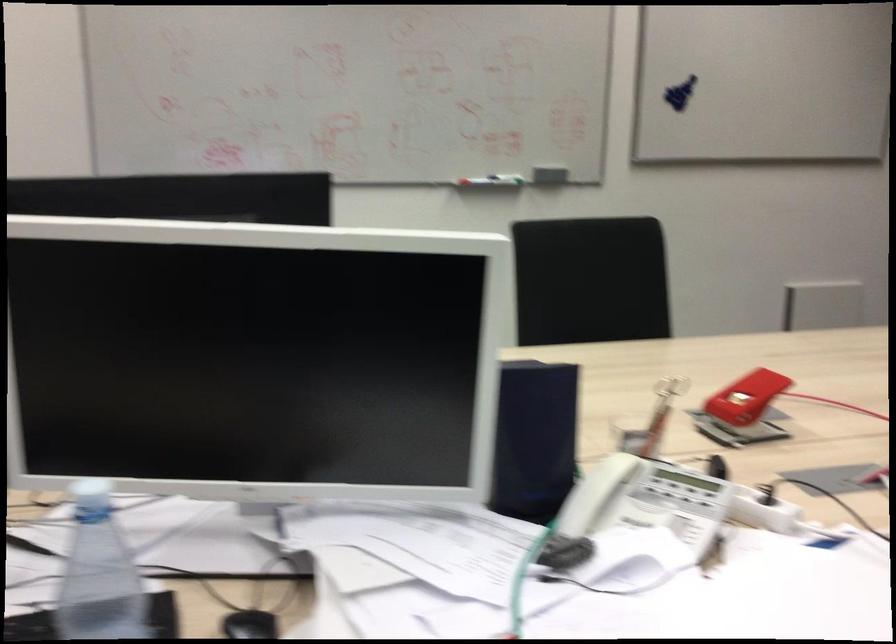
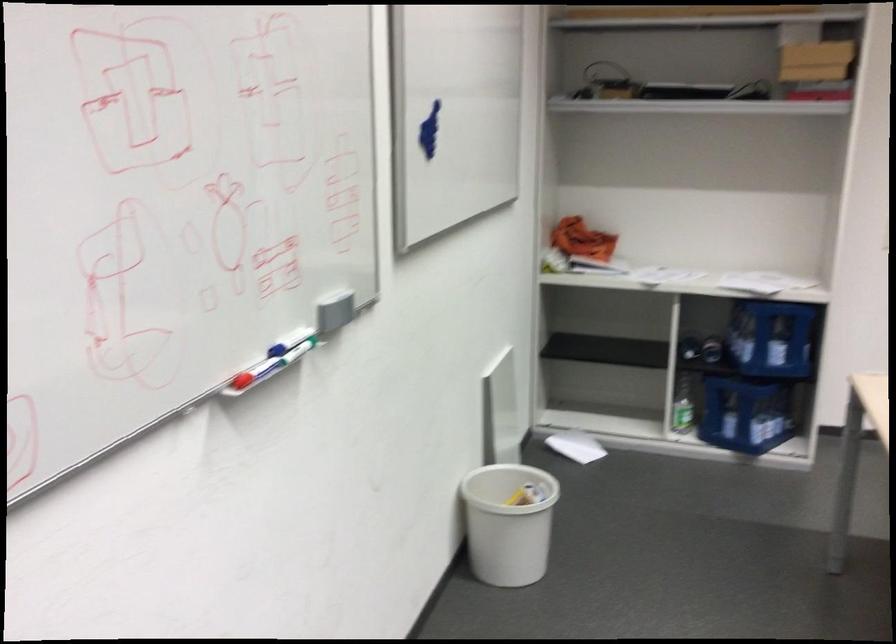
The point at [543,167] is marked in the first image. Where is the corresponding point in the second image?

(291, 337)